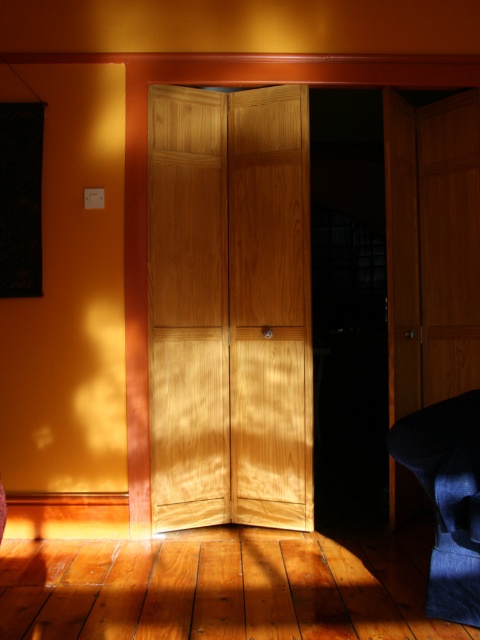
Question: Which object is farther from the camera taking this photo?

Choices:
 (A) light brown wood door at center
 (B) denim fabric armchair at lower right

Answer: (A)

Question: Which of the following is the closest to the observer?

Choices:
 (A) denim fabric armchair at lower right
 (B) light brown wood door at center

Answer: (A)

Question: Is light brown wood door at center smaller than denim fabric armchair at lower right?

Choices:
 (A) no
 (B) yes

Answer: (A)

Question: Can you confirm if light brown wood door at center is thinner than denim fabric armchair at lower right?

Choices:
 (A) yes
 (B) no

Answer: (B)

Question: Can you confirm if light brown wood door at center is positioned below denim fabric armchair at lower right?

Choices:
 (A) no
 (B) yes

Answer: (A)